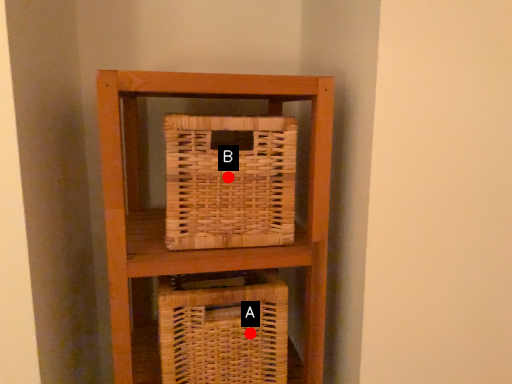
Question: Two points are circled on the image, labeled by A and B beside each circle. Which of the following is the closest to the observer?

Choices:
 (A) A is closer
 (B) B is closer

Answer: (B)